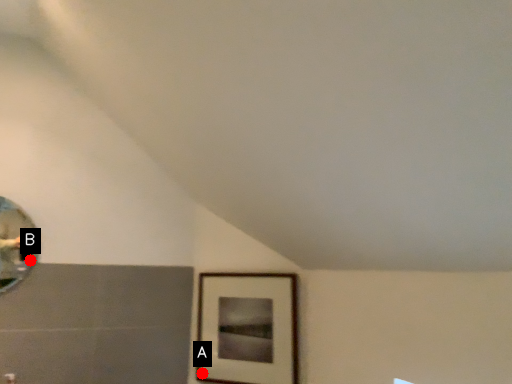
Question: Two points are circled on the image, labeled by A and B beside each circle. Which of the following is the closest to the observer?

Choices:
 (A) A is closer
 (B) B is closer

Answer: (B)